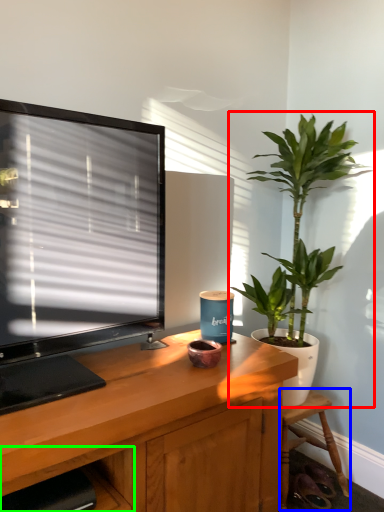
Question: Which object is the closest to the houseplant (highlighted by a red box)? Choose among these: chair (highlighted by a blue box) or shelf (highlighted by a green box).

Choices:
 (A) chair
 (B) shelf

Answer: (A)